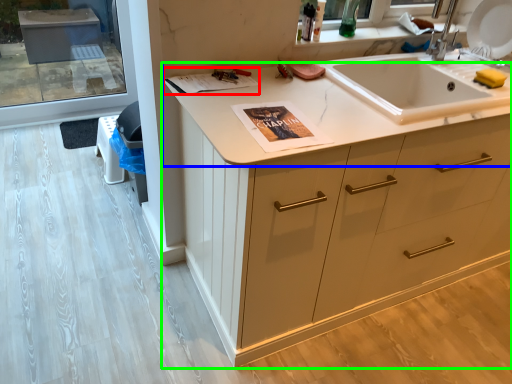
Question: Which object is the closest to the magazine (highlighted by a red box)? Choose among these: countertop (highlighted by a blue box) or cabinetry (highlighted by a green box).

Choices:
 (A) countertop
 (B) cabinetry

Answer: (A)